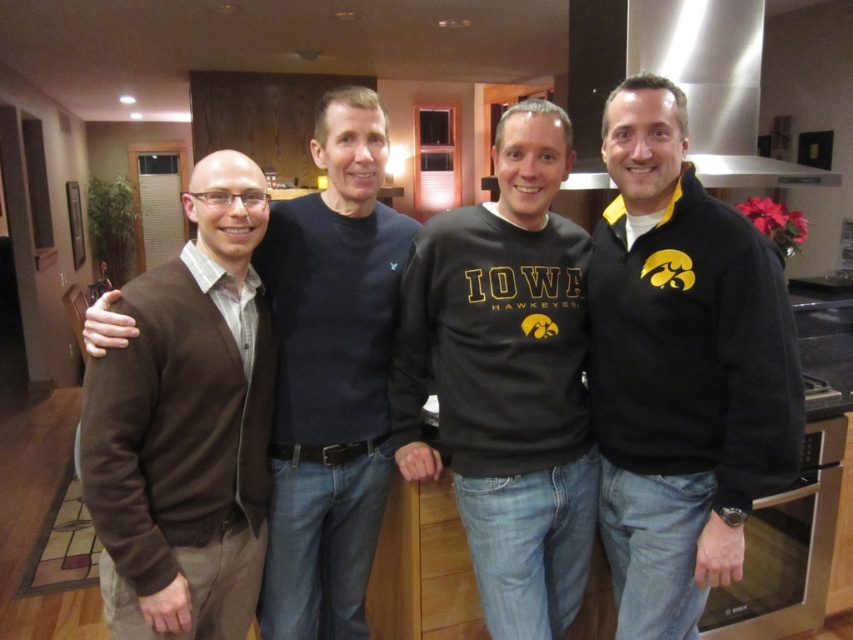
Question: Among these objects, which one is nearest to the camera?

Choices:
 (A) black fleece sweatshirt at right
 (B) stainless steel oven at right
 (C) brown sweater at left

Answer: (A)

Question: Can you confirm if brown sweater at left is bigger than stainless steel oven at right?

Choices:
 (A) yes
 (B) no

Answer: (A)

Question: Does black fleece sweatshirt at right appear over black matte sweatshirt at center?

Choices:
 (A) no
 (B) yes

Answer: (B)

Question: Which point is farther to the camera?

Choices:
 (A) (722, 403)
 (B) (277, 460)

Answer: (B)

Question: Is stainless steel exhaust hood at upper right positioned in front of stainless steel oven at right?

Choices:
 (A) yes
 (B) no

Answer: (B)

Question: Which object is farther from the camera taking this photo?

Choices:
 (A) stainless steel exhaust hood at upper right
 (B) black matte sweatshirt at center

Answer: (A)